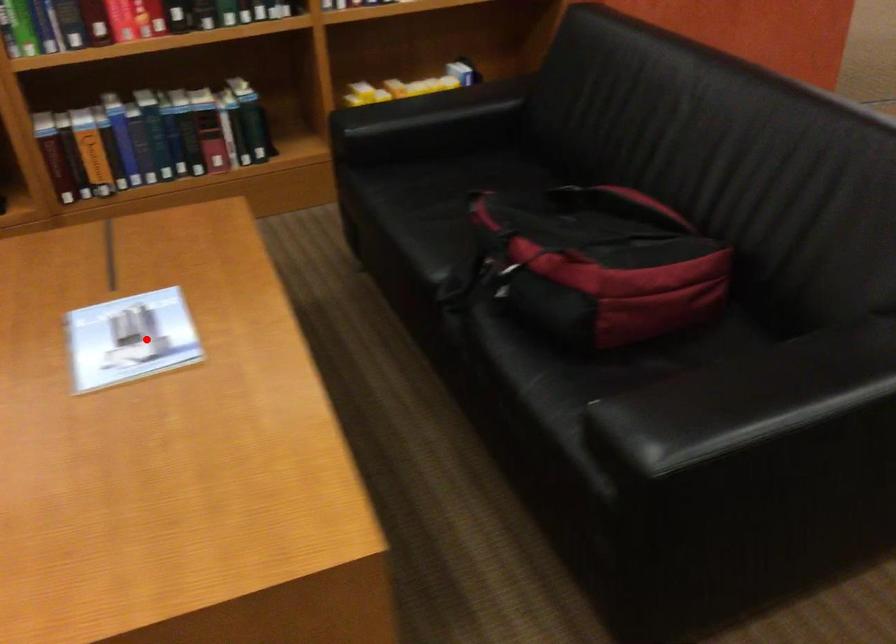
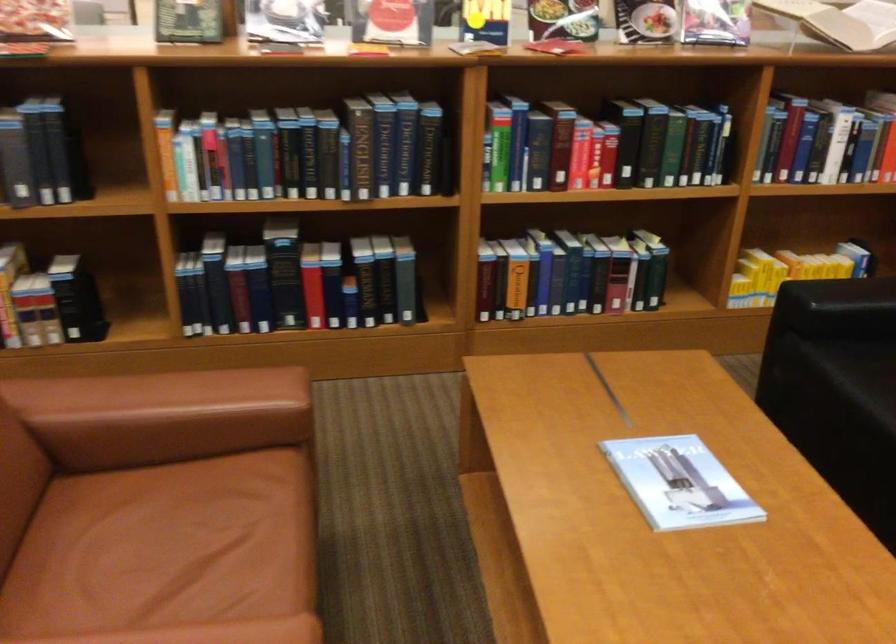
Where in the second image is the point corresponding to the highlighted location from the first image?

(678, 483)